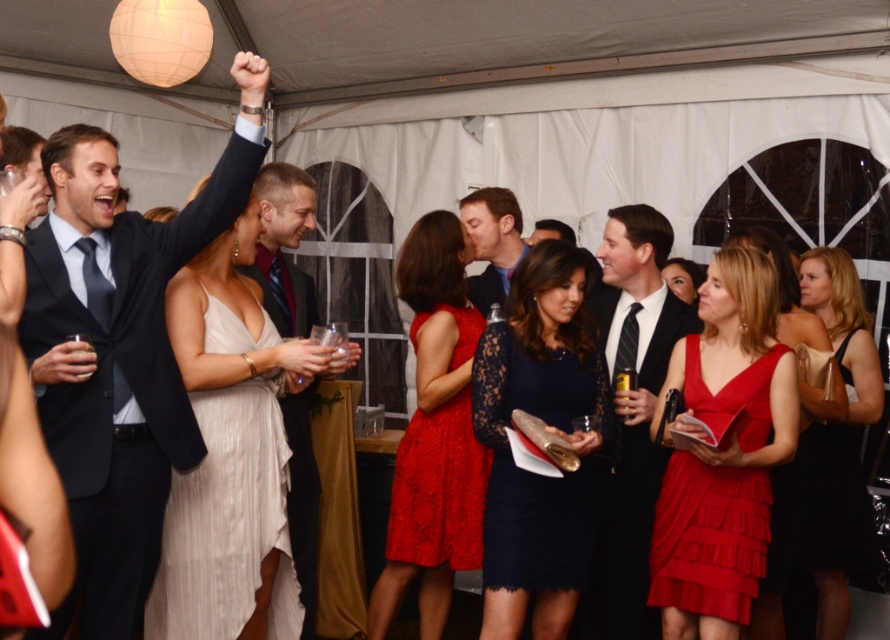
Is satin beige dress at center bigger than matte blue suit at center?

Yes, satin beige dress at center is bigger than matte blue suit at center.

Describe the element at coordinates (227, 522) in the screenshot. This screenshot has width=890, height=640. I see `satin beige dress at center` at that location.

Find the location of `satin beige dress at center`. satin beige dress at center is located at coordinates (227, 522).

Can you confirm if ruffled red dress at center is positioned above matte blue suit at center?

No.

Is ruffled red dress at center smaller than matte blue suit at center?

No.

Between point (771, 627) and point (484, 314), which one is positioned behind?

Point (484, 314)

Find the location of `ruffled red dress at center`. ruffled red dress at center is located at coordinates (785, 292).

Is point (390, 600) in front of point (624, 550)?

No.

Does lace dress at center have a greater width compared to black tie at center?

Yes, lace dress at center is wider than black tie at center.

Between point (476, 483) and point (668, 337), which one is positioned in front?

Positioned in front is point (668, 337).

The image size is (890, 640). I want to click on lace dress at center, so [434, 435].